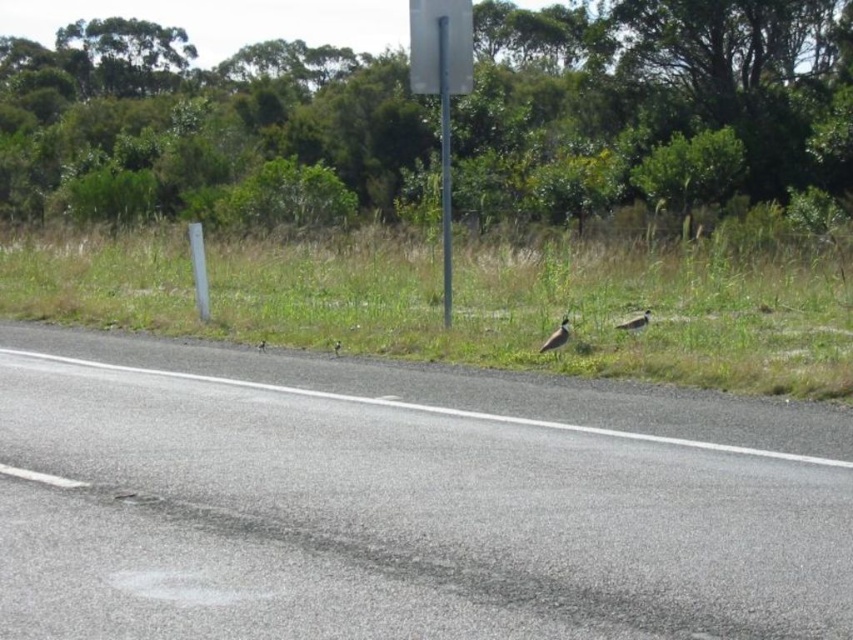
Is brown speckled bird at center-right further to the viewer compared to brown feathered bird at center?

No, it is not.

Is point (567, 326) in front of point (264, 342)?

That is True.

Is point (566, 332) closer to camera compared to point (259, 349)?

Yes.

You are a GUI agent. You are given a task and a screenshot of the screen. Output one action in this format:
    pyautogui.click(x=<x>, y=<y>)
    Task: Click on the brown speckled bird at center-right
    
    Given the screenshot: What is the action you would take?
    pyautogui.click(x=556, y=337)

Between point (331, 349) and point (260, 346), which one is positioned behind?

The point (260, 346) is more distant.

Who is shorter, brown speckled feather at center or brown feathered bird at center?

brown feathered bird at center is shorter.

Describe the element at coordinates (335, 348) in the screenshot. I see `brown speckled feather at center` at that location.

Where is `brown speckled feather at center`? brown speckled feather at center is located at coordinates (335, 348).

Image resolution: width=853 pixels, height=640 pixels. Describe the element at coordinates (403, 500) in the screenshot. I see `gray asphalt highway at center` at that location.

Who is more distant from viewer, (706, 618) or (410, 36)?

The point (410, 36) is more distant.

Is point (526, 464) positioned before point (445, 60)?

Yes, it is.

Locate an element on the screen. The image size is (853, 640). gray asphalt highway at center is located at coordinates (403, 500).